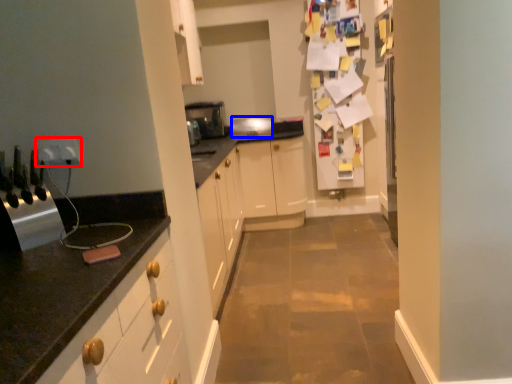
Question: Which of the following is the farthest to the observer, electric outlet (highlighted by a red box) or appliance (highlighted by a blue box)?

Choices:
 (A) electric outlet
 (B) appliance

Answer: (B)